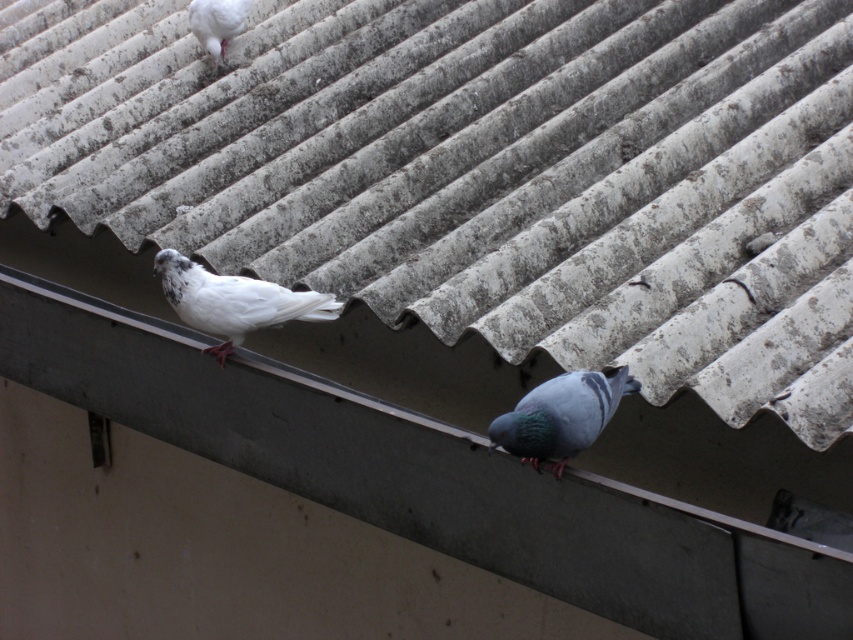
Question: Is white corrugated metal at upper center above white matte pigeon at upper left?

Choices:
 (A) yes
 (B) no

Answer: (B)

Question: Which of the following is the closest to the observer?

Choices:
 (A) shiny blue pigeon at center
 (B) white corrugated metal at upper center
 (C) white matte bird at center
 (D) white matte pigeon at upper left

Answer: (B)

Question: Is white matte bird at center above shiny blue pigeon at center?

Choices:
 (A) yes
 (B) no

Answer: (A)

Question: Which object is the farthest from the white matte pigeon at upper left?

Choices:
 (A) white matte bird at center
 (B) white corrugated metal at upper center
 (C) shiny blue pigeon at center

Answer: (C)

Question: Can you confirm if white corrugated metal at upper center is bigger than shiny blue pigeon at center?

Choices:
 (A) yes
 (B) no

Answer: (A)

Question: Among these objects, which one is farthest from the camera?

Choices:
 (A) white corrugated metal at upper center
 (B) shiny blue pigeon at center

Answer: (B)